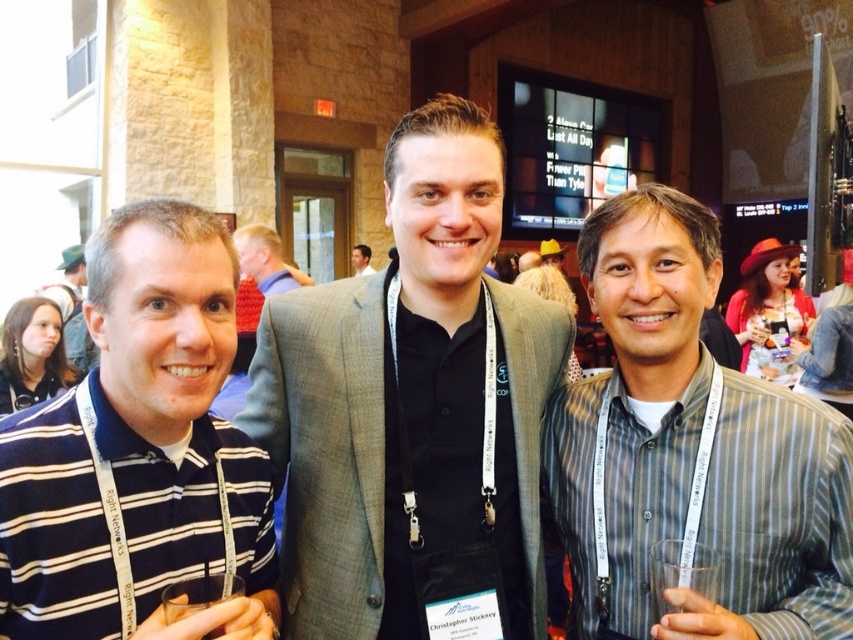
Question: Which object is positioned closest to the gray striped shirt at center?

Choices:
 (A) smooth black shirt at center
 (B) light brown hair at center

Answer: (B)

Question: Can you confirm if matte gray suit at center is positioned to the left of smooth black shirt at center?

Choices:
 (A) no
 (B) yes

Answer: (A)

Question: Is gray striped shirt at center above blue striped polo shirt at center?

Choices:
 (A) yes
 (B) no

Answer: (A)

Question: Estimate the real-world distances between objects in this image. Which object is closer to the blue striped polo shirt at center?

Choices:
 (A) gray striped shirt at center
 (B) light brown hair at center
 (C) matte gray suit at center
 (D) matte black shirt at left

Answer: (C)

Question: Which is farther from the matte gray suit at center?

Choices:
 (A) matte black shirt at left
 (B) blue striped polo shirt at center

Answer: (A)

Question: Does blue striped polo shirt at center have a greater width compared to matte black shirt at left?

Choices:
 (A) no
 (B) yes

Answer: (A)